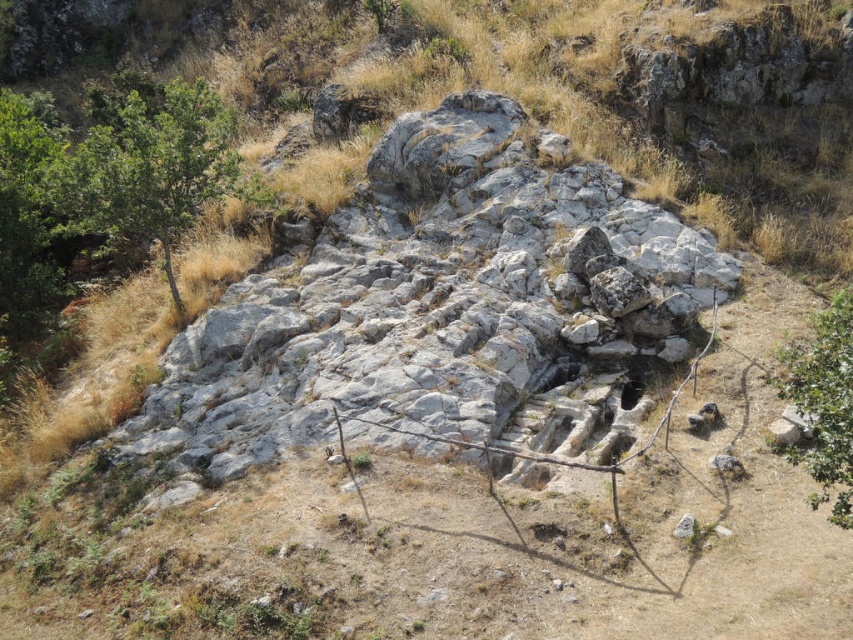
Between point (152, 202) and point (811, 444), which one is positioned in front?

Positioned in front is point (811, 444).

Which is behind, point (187, 93) or point (849, 387)?

The point (187, 93) is behind.

Is point (152, 188) farther from camera compared to point (848, 305)?

That is True.

This screenshot has height=640, width=853. I want to click on green leafy tree at left, so click(152, 168).